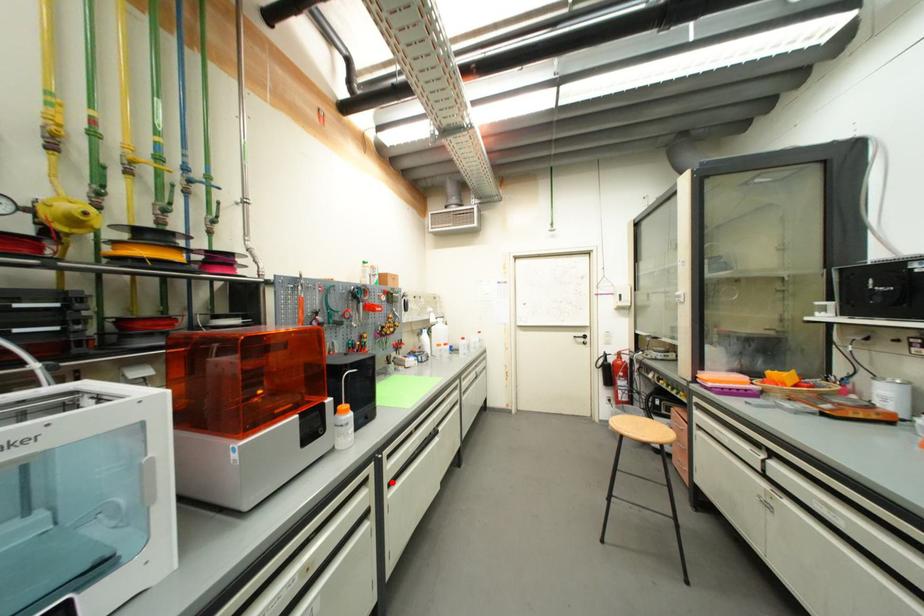
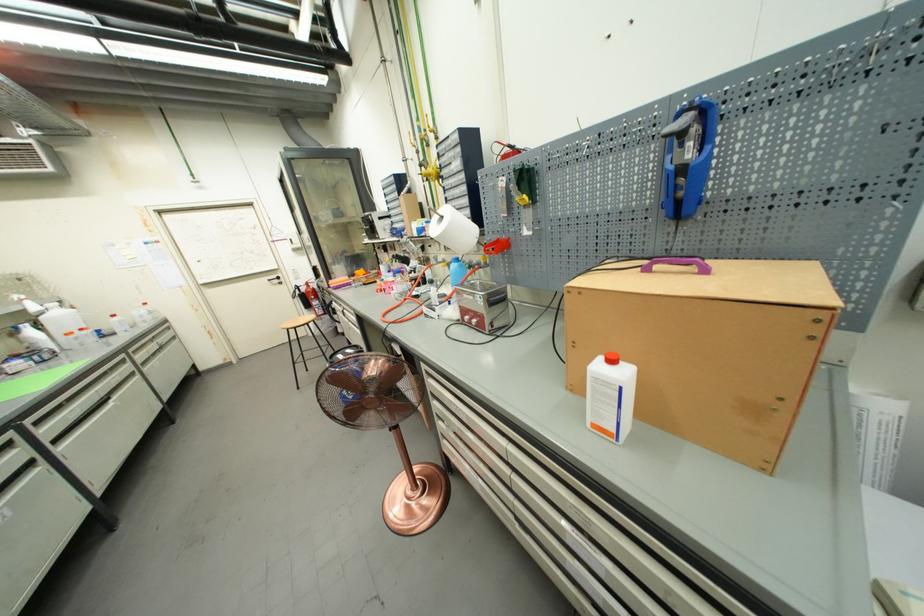
Question: I am providing you with two images of the same scene from different viewpoints. In image1, a red point is highlighted. Considering the same 3D point in image2, which of the following is correct?

Choices:
 (A) It is closer
 (B) It is farther

Answer: (B)